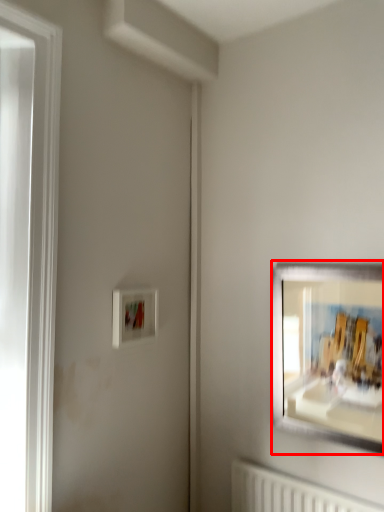
Question: From the image, what is the correct spatial relationship of picture frame (annotated by the red box) in relation to picture frame?

Choices:
 (A) right
 (B) left

Answer: (A)